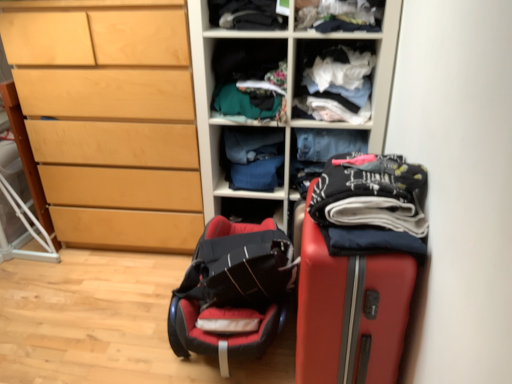
Question: From a real-world perspective, is wooden shelves at center located higher than dark gray fabric at upper center, positioned as the 3th clothing in back-to-front order?

Choices:
 (A) yes
 (B) no

Answer: (B)

Question: From the image's perspective, is wooden shelves at center on dark gray fabric at upper center, which is the 3th clothing in front-to-back order?

Choices:
 (A) yes
 (B) no

Answer: (B)

Question: Is wooden shelves at center positioned in front of dark gray fabric at upper center, which is the 3th clothing in front-to-back order?

Choices:
 (A) yes
 (B) no

Answer: (A)

Question: Is wooden shelves at center oriented away from dark gray fabric at upper center, which is the 3th clothing in front-to-back order?

Choices:
 (A) yes
 (B) no

Answer: (B)

Question: Is wooden shelves at center positioned far away from dark gray fabric at upper center, positioned as the 3th clothing in back-to-front order?

Choices:
 (A) no
 (B) yes

Answer: (A)

Question: Would you say white fabric at upper center, positioned as the first shelf in right-to-left order, is inside or outside blue fabric at center, which appears as the 1th clothing when viewed from the back?

Choices:
 (A) inside
 (B) outside

Answer: (B)

Question: In terms of width, does white fabric at upper center, which is the second shelf in left-to-right order, look wider or thinner when compared to blue fabric at center, which appears as the 1th clothing when viewed from the back?

Choices:
 (A) thin
 (B) wide

Answer: (B)

Question: Would you say white fabric at upper center, positioned as the first shelf in right-to-left order, is to the left or to the right of blue fabric at center, arranged as the 5th clothing when viewed from the front, in the picture?

Choices:
 (A) right
 (B) left

Answer: (A)

Question: Looking at the image, does white fabric at upper center, positioned as the first shelf in right-to-left order, seem bigger or smaller compared to blue fabric at center, arranged as the 5th clothing when viewed from the front?

Choices:
 (A) small
 (B) big

Answer: (B)

Question: From the image's perspective, is soft leather suitcase at lower left located above or below textured fabric clothes at center, which is counted as the 2th shelf, starting from the right?

Choices:
 (A) above
 (B) below

Answer: (B)

Question: Do you think soft leather suitcase at lower left is within textured fabric clothes at center, which appears as the first shelf when viewed from the left, or outside of it?

Choices:
 (A) inside
 (B) outside

Answer: (B)

Question: In the image, is soft leather suitcase at lower left positioned in front of or behind textured fabric clothes at center, which is counted as the 2th shelf, starting from the right?

Choices:
 (A) behind
 (B) front

Answer: (B)

Question: Is point (267, 218) positioned closer to the camera than point (268, 48)?

Choices:
 (A) closer
 (B) farther

Answer: (B)

Question: Considering the positions of printed cotton pants at right, which appears as the 1th clothing when viewed from the front, and blue fabric at center, arranged as the 5th clothing when viewed from the front, in the image, is printed cotton pants at right, which appears as the 1th clothing when viewed from the front, taller or shorter than blue fabric at center, arranged as the 5th clothing when viewed from the front,?

Choices:
 (A) tall
 (B) short

Answer: (B)

Question: Relative to blue fabric at center, arranged as the 5th clothing when viewed from the front, is printed cotton pants at right, the 5th clothing from the back, in front or behind?

Choices:
 (A) behind
 (B) front

Answer: (B)